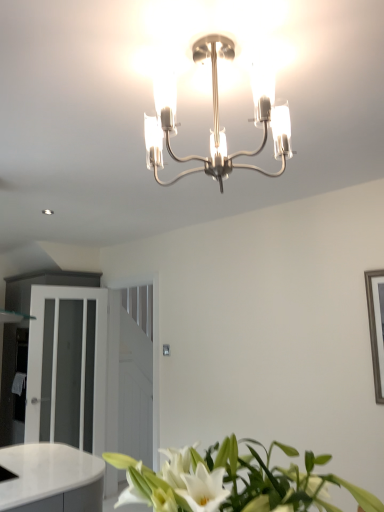
Question: Is white glossy leaves at lower center bigger than polished chrome chandelier at center?

Choices:
 (A) no
 (B) yes

Answer: (B)

Question: Is polished chrome chandelier at center at the back of white glossy leaves at lower center?

Choices:
 (A) no
 (B) yes

Answer: (A)

Question: From a real-world perspective, is white glossy leaves at lower center beneath polished chrome chandelier at center?

Choices:
 (A) no
 (B) yes

Answer: (B)

Question: Does white glossy leaves at lower center have a greater width compared to polished chrome chandelier at center?

Choices:
 (A) no
 (B) yes

Answer: (B)

Question: Does white glossy leaves at lower center appear on the left side of polished chrome chandelier at center?

Choices:
 (A) yes
 (B) no

Answer: (B)

Question: From the image's perspective, relative to polished chrome chandelier at center, is white frosted glass door at left above or below?

Choices:
 (A) above
 (B) below

Answer: (B)

Question: Considering the positions of white frosted glass door at left and polished chrome chandelier at center in the image, is white frosted glass door at left wider or thinner than polished chrome chandelier at center?

Choices:
 (A) wide
 (B) thin

Answer: (B)

Question: Is white frosted glass door at left bigger or smaller than polished chrome chandelier at center?

Choices:
 (A) small
 (B) big

Answer: (B)

Question: Considering the relative positions of white frosted glass door at left and polished chrome chandelier at center in the image provided, is white frosted glass door at left to the left or to the right of polished chrome chandelier at center?

Choices:
 (A) right
 (B) left

Answer: (B)

Question: Is white glossy leaves at lower center in front of or behind white glossy dresser at left in the image?

Choices:
 (A) front
 (B) behind

Answer: (A)

Question: Is point (377, 506) positioned closer to the camera than point (66, 389)?

Choices:
 (A) farther
 (B) closer

Answer: (B)

Question: From a real-world perspective, relative to white glossy dresser at left, is white glossy leaves at lower center vertically above or below?

Choices:
 (A) below
 (B) above

Answer: (A)

Question: Is white glossy leaves at lower center wider or thinner than white glossy dresser at left?

Choices:
 (A) wide
 (B) thin

Answer: (B)

Question: In the image, is white glossy dresser at left positioned in front of or behind white frosted glass door at left?

Choices:
 (A) behind
 (B) front

Answer: (A)

Question: Do you think white glossy dresser at left is within white frosted glass door at left, or outside of it?

Choices:
 (A) outside
 (B) inside

Answer: (A)